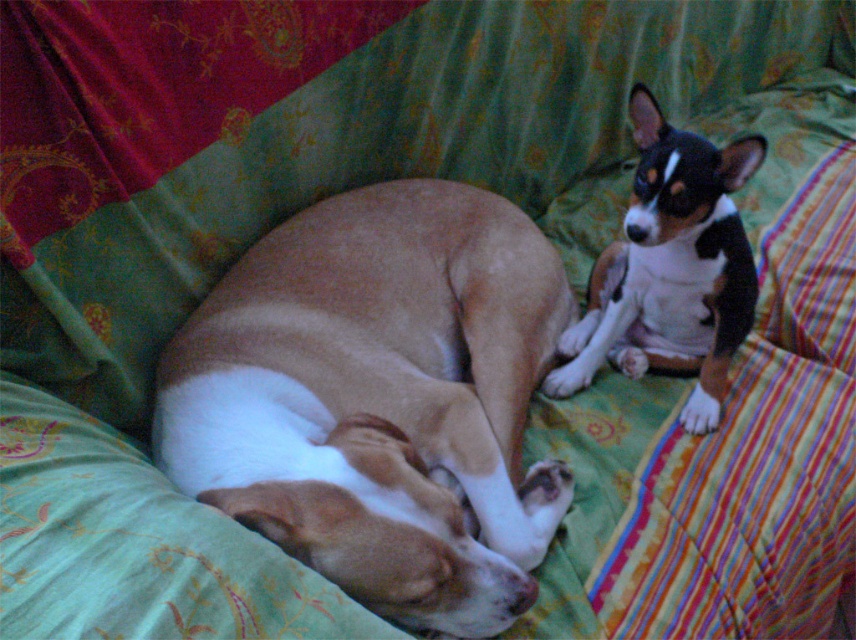
You are a veterinarian examining the dogs in the image. You need to check the smaller dog first. Which dog should you approach first, the brown matte dog at center or the black and white fur at upper right?

The black and white fur at upper right is the smaller dog, so you should approach the black and white fur at upper right first.

You are standing at the origin point of the coordinate system in the image. You want to throw a treat to the brown matte dog at center. Which direction should you throw the treat to reach the dog?

The brown matte dog at center is located at point (379,397) in the coordinate system. Since you are at the origin, you should throw the treat in the positive x and positive y direction to reach the dog.

You are a pet sitter who needs to place a 12 inch long toy between the brown matte dog at center and the black and white fur at upper right. Can the toy fit in the space between them without touching either dog?

The distance between the brown matte dog at center and the black and white fur at upper right is 11.53 inches. Since the toy is 12 inches long, it cannot fit in the space between them without overlapping or touching either dog.